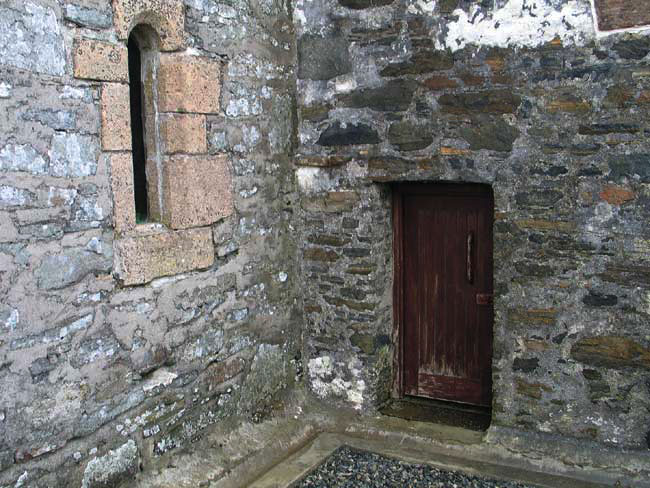
This screenshot has width=650, height=488. In order to click on door mat in this screenshot , I will do `click(461, 421)`.